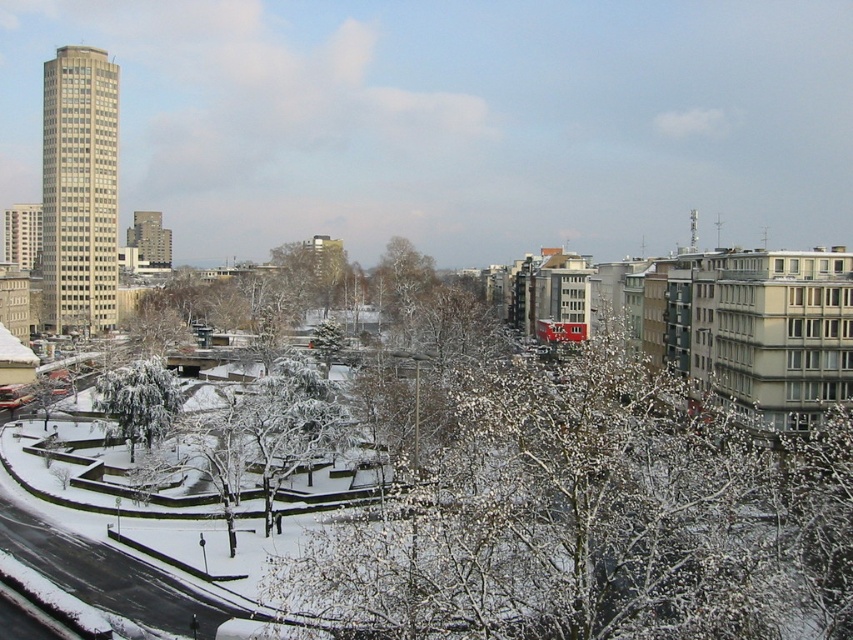
Does white snow-covered tree at center have a greater width compared to white frosty tree at lower left?

Indeed, white snow-covered tree at center has a greater width compared to white frosty tree at lower left.

This screenshot has width=853, height=640. I want to click on white snow-covered tree at center, so 596,518.

Locate an element on the screen. white snow-covered tree at center is located at coordinates (596, 518).

Find the location of a particular element. This screenshot has width=853, height=640. white snow-covered tree at center is located at coordinates (596, 518).